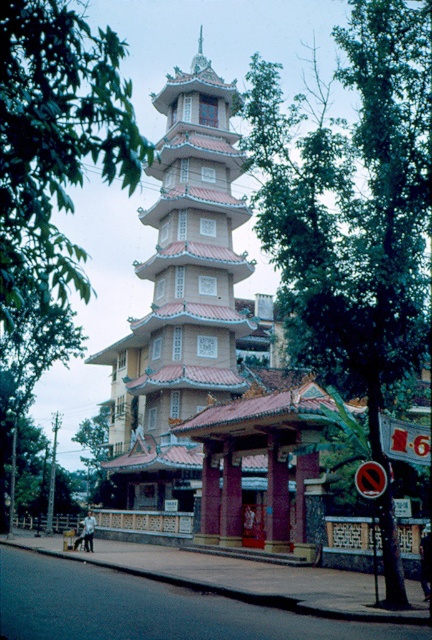
You are a landscape architect planning to add a new pathway between the green leafy tree at center and the green leafy tree at upper left. Since the trees have different widths, which tree should the pathway be closer to to ensure it doesn

The pathway should be closer to the green leafy tree at center because it has a lesser width compared to the green leafy tree at upper left, allowing more space around the wider tree.

From the picture: You are standing at the entrance of the pagoda and want to locate two specific points marked in the image. The first point is at coordinates point (425, 308), and the second is at point (5, 157). From your current position, which point is closer to you?

Point (5, 157) is closer to you because it is in front of point (425, 308).

You are a tourist standing at the entrance of the pagoda and want to take a photo that includes both the beige textured pagoda at center and the green leafy tree at upper left. Based on their positions, which object should be placed to the left in your photo composition?

The green leafy tree at upper left should be placed to the left in your photo composition because the beige textured pagoda at center is positioned on the right side of the green leafy tree at upper left.